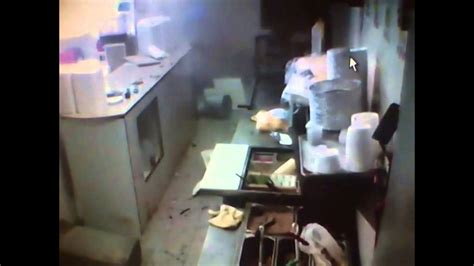
The width and height of the screenshot is (474, 266). In order to click on cabinet in this screenshot , I will do `click(158, 116)`.